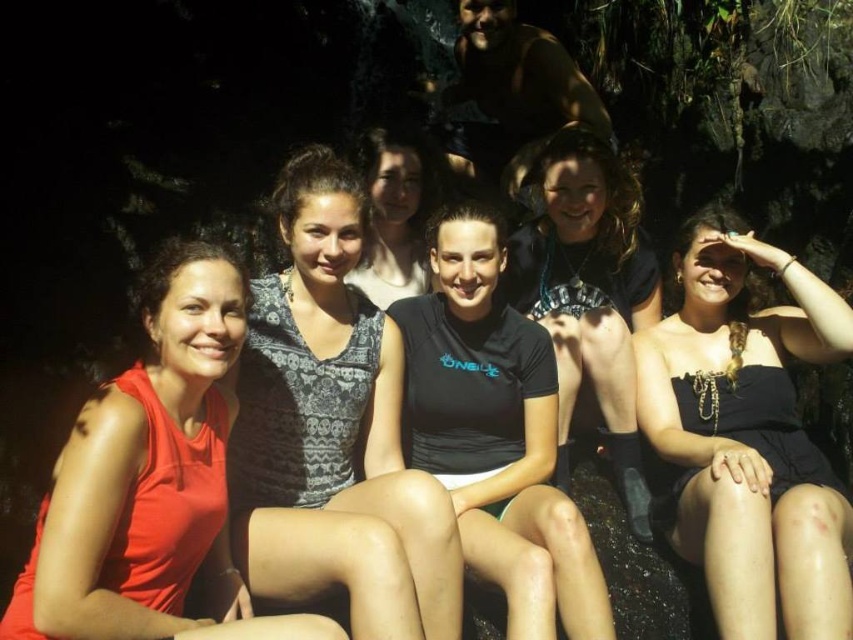
You are standing in the scene and want to hand a drink to the person wearing the patterned fabric dress at center. Which direction should you approach from to avoid the other people nearby?

The patterned fabric dress at center is located at point (334, 432), so you should approach from the left side to avoid the other people nearby.

You are standing at the center of the image and want to move towards the point labeled as point [495,433]. Which object will you encounter first?

The point labeled [495,433] corresponds to the black matte shirt at center, so you will encounter the black matte shirt at center first.